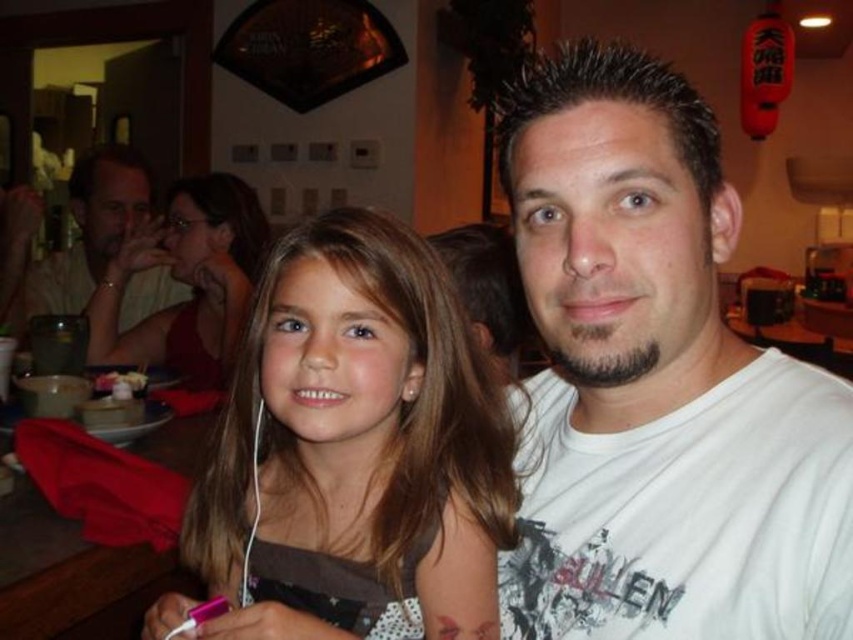
Can you confirm if brown hair at center is taller than matte white shirt at upper left?

In fact, brown hair at center may be shorter than matte white shirt at upper left.

Is point (486, 515) less distant than point (22, 314)?

Yes, point (486, 515) is closer to viewer.

This screenshot has height=640, width=853. Find the location of `brown hair at center`. brown hair at center is located at coordinates (357, 448).

Can you confirm if matte red dress at upper left is positioned below matte white shirt at upper left?

Yes.

The image size is (853, 640). What are the coordinates of `matte red dress at upper left` in the screenshot? It's located at (186, 282).

The width and height of the screenshot is (853, 640). What are the coordinates of `matte red dress at upper left` in the screenshot? It's located at (186, 282).

Who is taller, white cotton t-shirt at center or matte white shirt at upper left?

With more height is matte white shirt at upper left.

Who is higher up, white cotton t-shirt at center or matte white shirt at upper left?

matte white shirt at upper left is above.

Describe the element at coordinates (657, 385) in the screenshot. The height and width of the screenshot is (640, 853). I see `white cotton t-shirt at center` at that location.

You are a GUI agent. You are given a task and a screenshot of the screen. Output one action in this format:
    pyautogui.click(x=<x>, y=<y>)
    Task: Click on the white cotton t-shirt at center
    This screenshot has height=640, width=853.
    Given the screenshot: What is the action you would take?
    pyautogui.click(x=657, y=385)